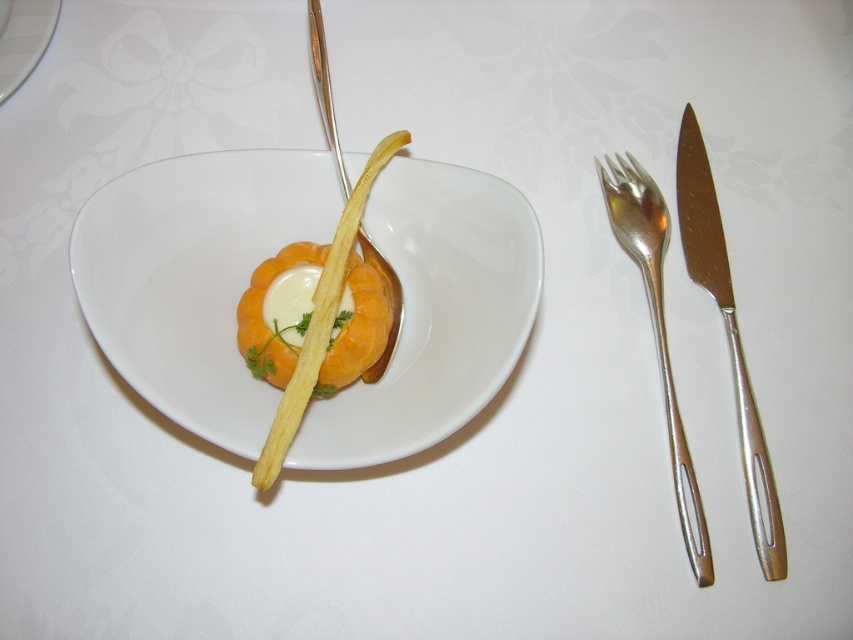
You are a food critic who wants to taste the creamy white substance in the hollowed fruit. The polished silver knife at right is the only utensil available. Can you reach the substance with the knife without moving your hand?

The polished silver knife at right is 31.84 inches from viewer, so yes, you can reach the creamy white substance in the hollowed fruit with the knife without moving your hand since the distance is within typical arm reach.

You are a food critic sitting at the table. You want to use the silver metallic fork at right to eat the contents of the white glossy bowl at center. Can you reach the bowl without moving the fork?

The white glossy bowl at center is located above the silver metallic fork at right, so you can easily reach the bowl by moving your hand downward from the bowl to the fork since it is positioned above the fork.

Consider the image. You are a food stylist who needs to place a 10 cm long decorative stick exactly 5 cm away from the edge of the white glossy bowl at center. Can you do this without the stick touching the bowl?

The white glossy bowl at center is 70.82 centimeters away from the viewer. Since the distance from the edge of the bowl to the viewer is 70.82 cm minus the bowl radius, but without knowing the bowl size, we can only confirm the total distance. However, the question specifies placing the stick 5 cm from the edge, which is a relative position on the bowl itself. The 70.82 cm distance refers to the viewer, so the placement is feasible as long as the stick is positioned 5 cm away from the bowl edge without encr